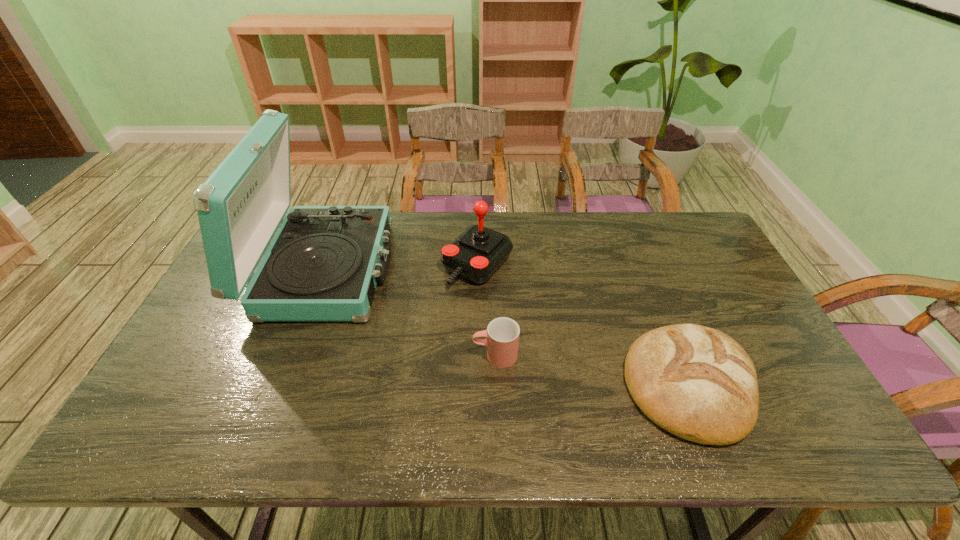
Find the location of a particular element. blank space located on the left of the bread is located at coordinates (471, 385).

Identify the location of record player that is positioned at the far edge. The width and height of the screenshot is (960, 540). (323, 265).

At what (x,y) coordinates should I click in order to perform the action: click on joystick present at the far edge. Please return your answer as a coordinate pair (x, y). Looking at the image, I should click on (475, 255).

The image size is (960, 540). What are the coordinates of `object that is at the near edge` in the screenshot? It's located at (696, 382).

Where is `object positioned at the left edge`? The width and height of the screenshot is (960, 540). object positioned at the left edge is located at coordinates (323, 265).

Locate an element on the screen. This screenshot has width=960, height=540. object that is at the right edge is located at coordinates (696, 382).

Where is `object that is at the far left corner`? object that is at the far left corner is located at coordinates click(x=323, y=265).

The width and height of the screenshot is (960, 540). Find the location of `object at the near right corner`. object at the near right corner is located at coordinates (696, 382).

The image size is (960, 540). I want to click on vacant space at the far edge, so click(x=585, y=251).

In the image, there is a desktop. Where is `vacant space at the near edge`? vacant space at the near edge is located at coordinates (640, 416).